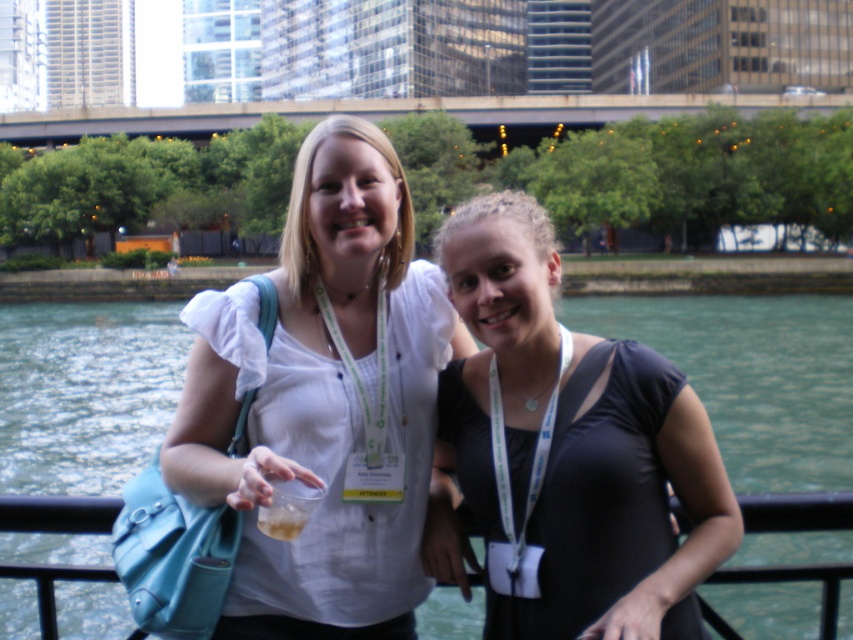
Question: Among these objects, which one is nearest to the camera?

Choices:
 (A) black matte dress at center
 (B) white matte shirt at center
 (C) green water at river right
 (D) black metal railing at lower center

Answer: (A)

Question: From the image, what is the correct spatial relationship of white matte shirt at center in relation to green water at river right?

Choices:
 (A) above
 (B) below

Answer: (A)

Question: Which object is the closest to the black matte dress at center?

Choices:
 (A) black metal railing at lower center
 (B) white matte shirt at center

Answer: (B)

Question: Based on their relative distances, which object is nearer to the black metal railing at lower center?

Choices:
 (A) white matte shirt at center
 (B) black matte dress at center
 (C) green water at river right

Answer: (A)

Question: Does white matte shirt at center appear on the right side of green water at river right?

Choices:
 (A) no
 (B) yes

Answer: (A)

Question: Where is white matte shirt at center located in relation to black metal railing at lower center in the image?

Choices:
 (A) right
 (B) left

Answer: (A)